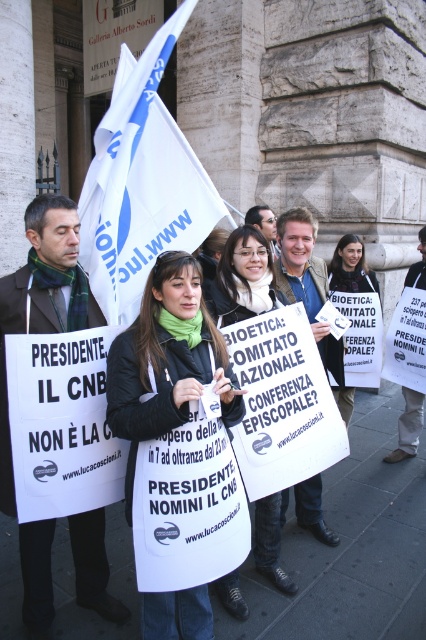
Question: Is white fabric flag at upper center thinner than black fabric jacket at center?

Choices:
 (A) no
 (B) yes

Answer: (A)

Question: From the image, what is the correct spatial relationship of white fabric flag at upper center in relation to white paper sign at center?

Choices:
 (A) left
 (B) right

Answer: (A)

Question: Which of the following is the farthest from the observer?

Choices:
 (A) (132, 417)
 (B) (226, 278)
 (C) (135, 301)

Answer: (C)

Question: Among these objects, which one is farthest from the camera?

Choices:
 (A) white paper sign at center
 (B) white fabric flag at upper center
 (C) black fabric jacket at center

Answer: (B)

Question: Which point is closer to the camera?

Choices:
 (A) white fabric flag at upper center
 (B) matte black jacket at center
 (C) white paper sign at center
 (D) black fabric jacket at center

Answer: (D)

Question: Is black fabric jacket at center below white paper sign at center?

Choices:
 (A) no
 (B) yes

Answer: (B)